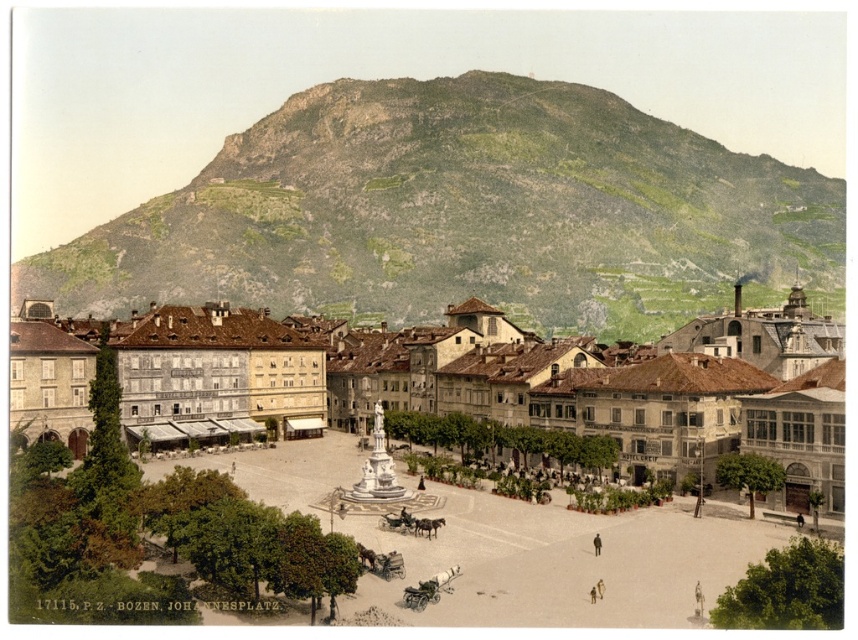
Question: Which of the following is the closest to the observer?

Choices:
 (A) matte stone fountain at center
 (B) dark brown coat at center
 (C) green grassy mountain at upper center

Answer: (B)

Question: Can you confirm if green grassy mountain at upper center is positioned above matte stone fountain at center?

Choices:
 (A) yes
 (B) no

Answer: (A)

Question: Is green grassy mountain at upper center closer to camera compared to matte stone fountain at center?

Choices:
 (A) yes
 (B) no

Answer: (B)

Question: In this image, where is green grassy mountain at upper center located relative to matte stone fountain at center?

Choices:
 (A) above
 (B) below

Answer: (A)

Question: Which point is farther to the camera?

Choices:
 (A) dark brown coat at center
 (B) matte stone fountain at center
 (C) green grassy mountain at upper center

Answer: (C)

Question: Which of the following is the closest to the observer?

Choices:
 (A) (65, 372)
 (B) (133, 232)

Answer: (A)